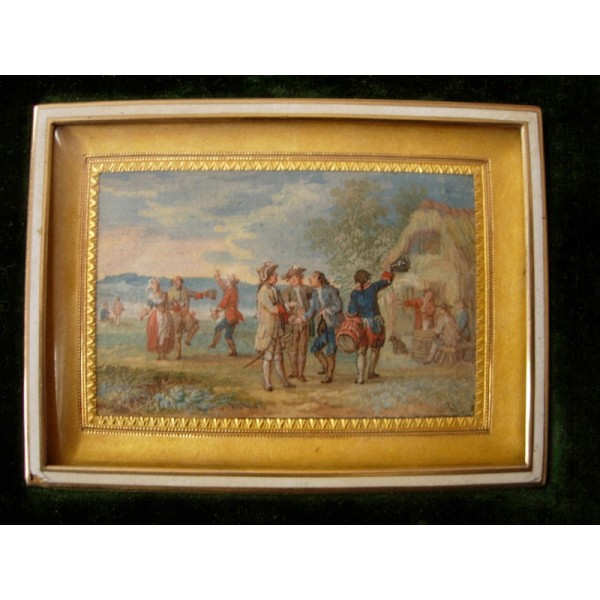
Image resolution: width=600 pixels, height=600 pixels. I want to click on frame, so click(x=312, y=453).